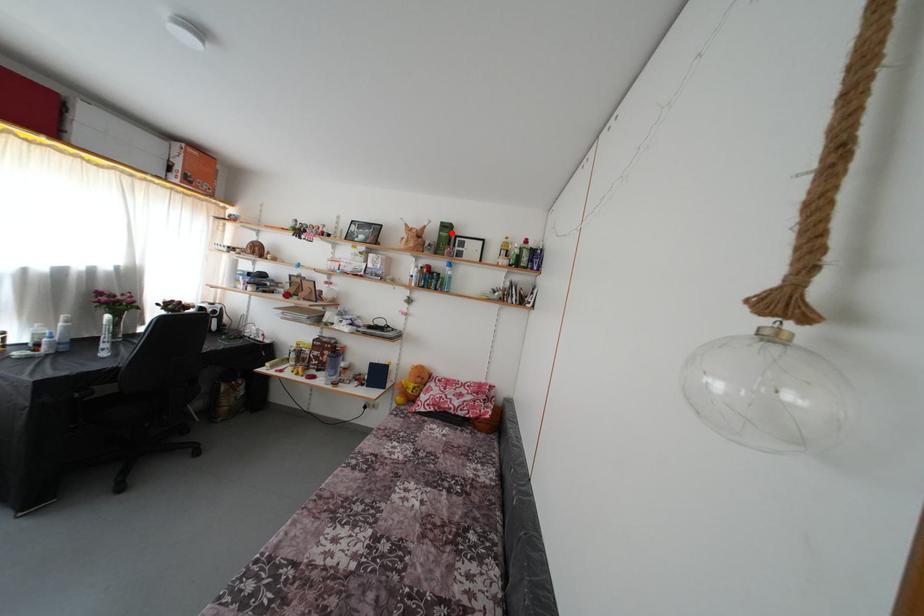
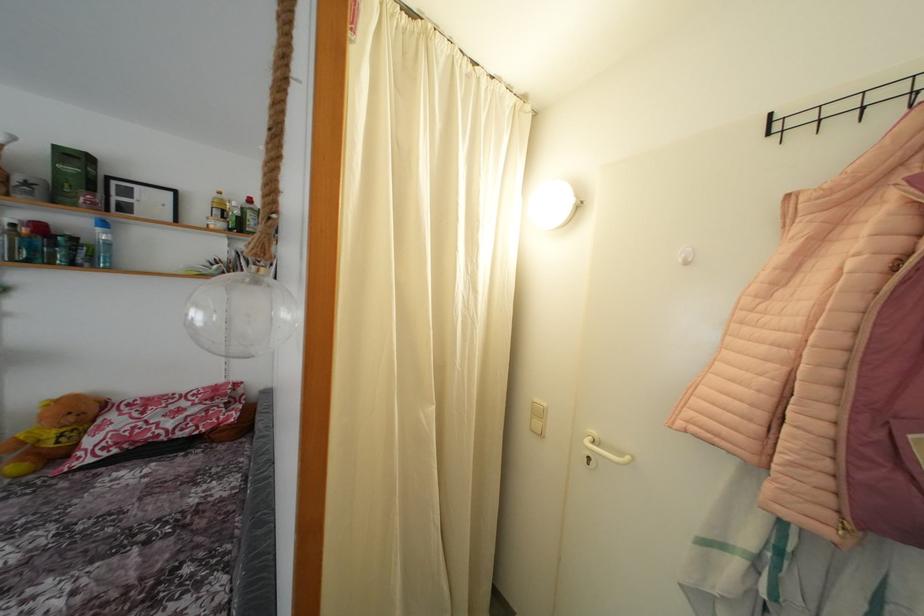
Find the pixel in the second image that matches the highlighted location in the first image.

(80, 163)